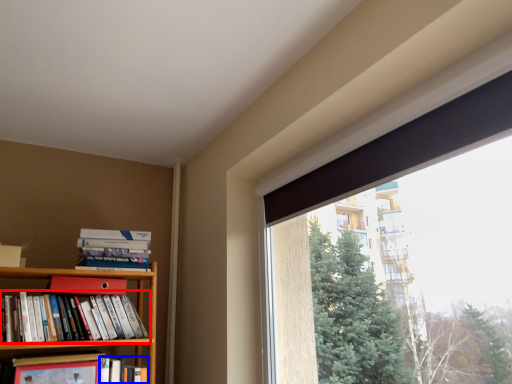
Question: Among these objects, which one is farthest to the camera, book (highlighted by a red box) or book (highlighted by a blue box)?

Choices:
 (A) book
 (B) book

Answer: (B)